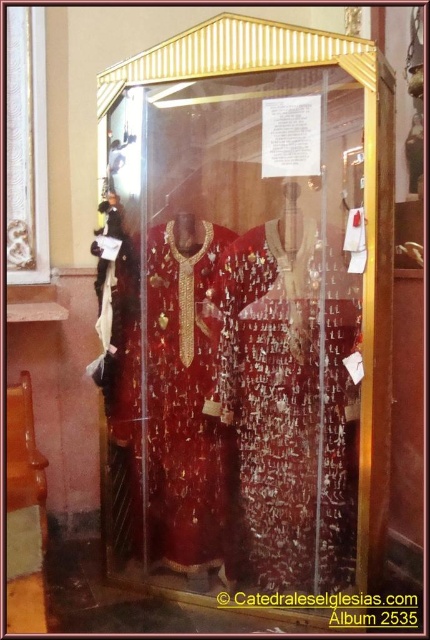
You are a museum visitor holding a 24 inch ruler. You want to measure the distance between the transparent glass door at center and the black paper at center. Can you do it with your ruler?

The distance between the transparent glass door at center and the black paper at center is 24.15 inches. Since your ruler is 24 inches long, it is slightly shorter than the required distance. You might need a slightly longer ruler to accurately measure the full length.

You are a museum visitor holding a camera with a 4 inch long lens. You want to take a photo of the shiny gold fabric robe at center through the transparent glass door at center. Can you position your camera close enough to the glass door to capture the robe without the lens touching the glass door?

The transparent glass door at center and shiny gold fabric robe at center are 3.95 inches apart. Since the lens is 4 inches long, positioning the camera so the lens doesn not touch the glass door would leave insufficient space to reach the robe. Thus, the lens would touch the glass door if you get close enough to capture the robe.